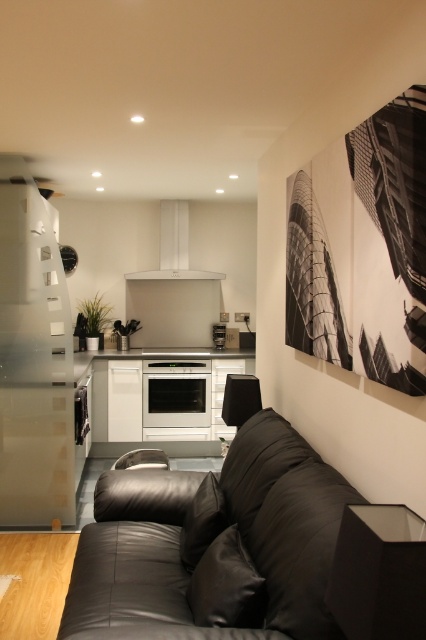
You are standing in the living room and want to know how far you are from the point marked at coordinates (187, 419). Can you determine the distance?

The distance between you and the point marked at coordinates (187, 419) is 5.23 meters.

You are arranging a dinner party and need to place a decorative centerpiece between the satin silver oven at center and the white glossy exhaust hood at center. Based on their positions, which appliance should the centerpiece be placed closer to?

The centerpiece should be placed closer to the satin silver oven at center because it is positioned to the left of the white glossy exhaust hood at center.

Consider the image. You are standing in the living room and want to take a photo of both point (403,589) and point (190,419). Which point should you focus on first to ensure both are in clear view?

Point (403,589) is closer to the camera than point (190,419), so you should focus on point (403,589) first to ensure both are in clear view.